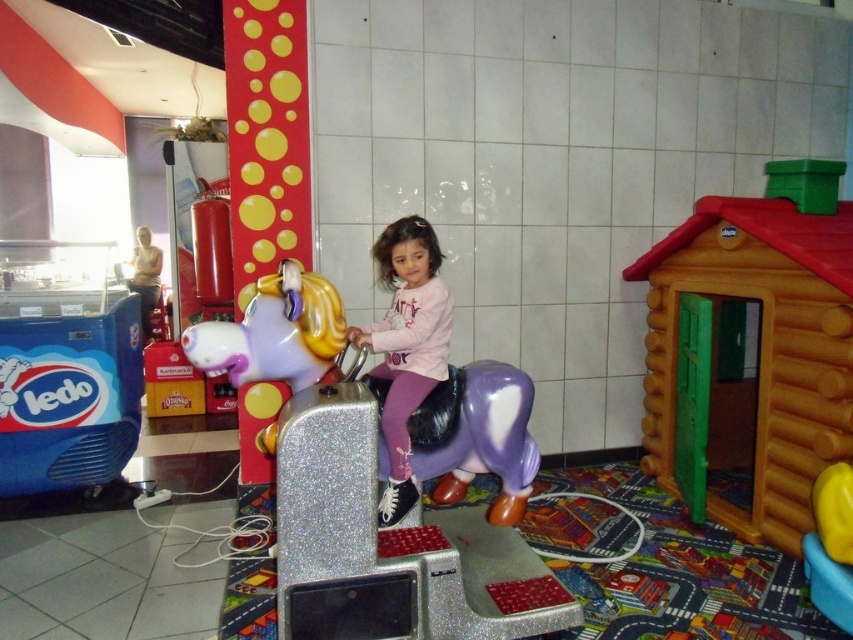
Can you confirm if shiny purple plastic horse at center is shorter than orange plastic playhouse at right?

Indeed, shiny purple plastic horse at center has a lesser height compared to orange plastic playhouse at right.

Does shiny purple plastic horse at center appear under orange plastic playhouse at right?

Yes.

Does point (300, 272) lie behind point (671, 300)?

That is False.

In order to click on shiny purple plastic horse at center in this screenshot , I will do `click(363, 493)`.

In the scene shown: Does orange plastic playhouse at right appear on the right side of pink matte unicorn at center?

Yes, orange plastic playhouse at right is to the right of pink matte unicorn at center.

Between orange plastic playhouse at right and pink matte unicorn at center, which one appears on the right side from the viewer's perspective?

orange plastic playhouse at right is more to the right.

Which is in front, point (711, 440) or point (416, 252)?

Positioned in front is point (416, 252).

Locate an element on the screen. orange plastic playhouse at right is located at coordinates (752, 348).

Who is positioned more to the left, shiny purple plastic horse at center or pink matte unicorn at center?

shiny purple plastic horse at center

Is point (265, 284) behind point (374, 339)?

That is False.

Between point (286, 406) and point (450, 310), which one is positioned in front?

Point (286, 406) is in front.

Find the location of a particular element. shiny purple plastic horse at center is located at coordinates (363, 493).